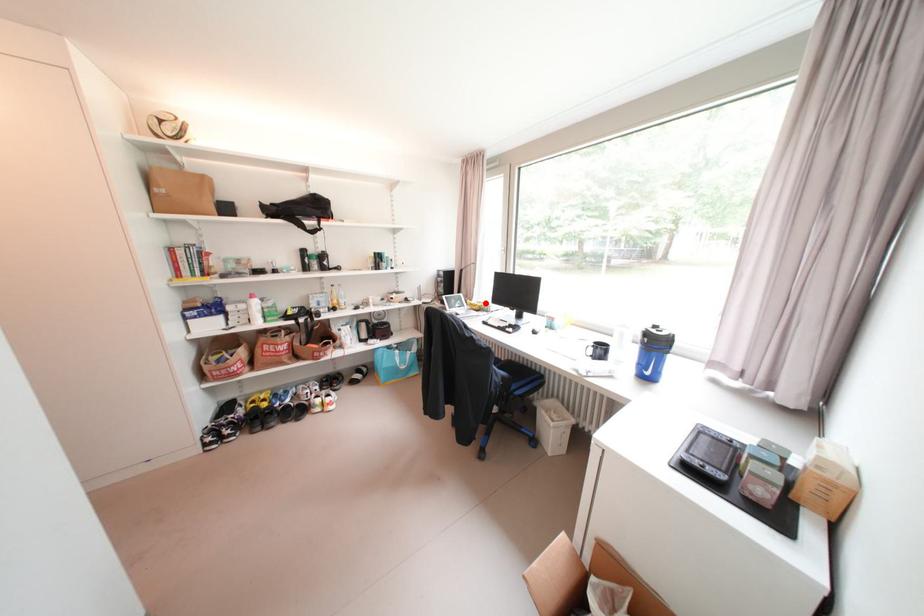
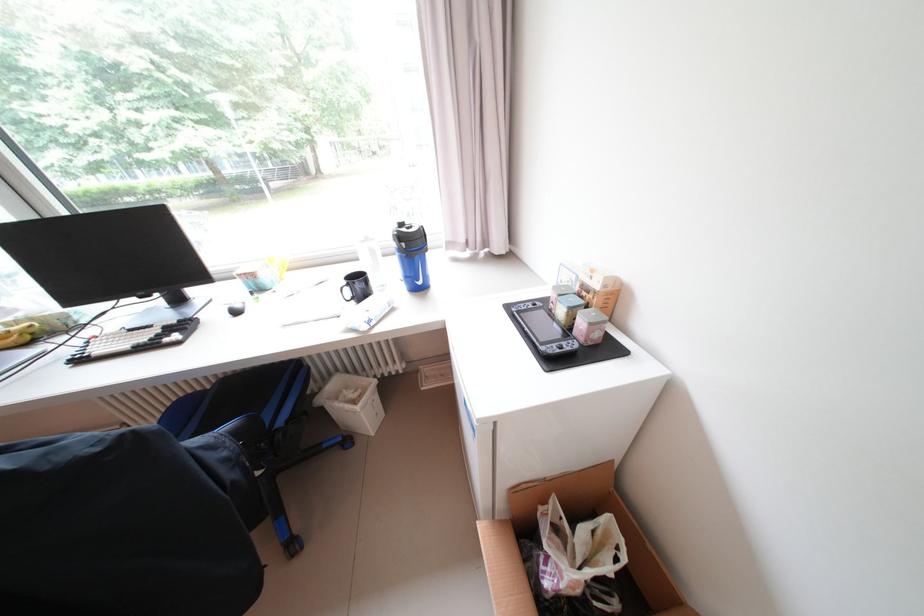
The point at the highlighted location is marked in the first image. Where is the corresponding point in the second image?

(15, 326)